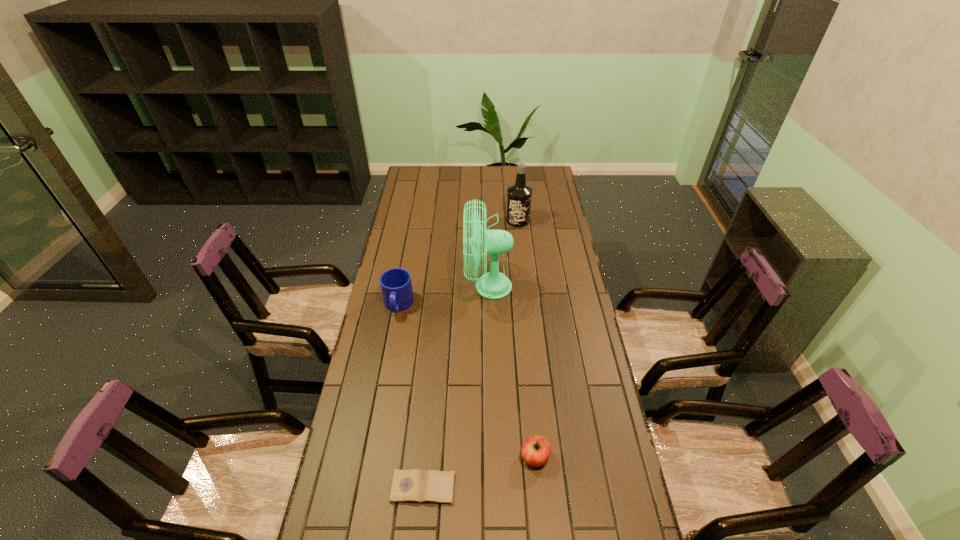
You are a GUI agent. You are given a task and a screenshot of the screen. Output one action in this format:
    pyautogui.click(x=<x>, y=<y>)
    Task: Click on the fan
    
    Given the screenshot: What is the action you would take?
    pyautogui.click(x=493, y=285)

The height and width of the screenshot is (540, 960). In order to click on the fourth shortest object in this screenshot , I will do `click(519, 195)`.

I want to click on the farthest object, so click(x=519, y=195).

This screenshot has width=960, height=540. In order to click on mug in this screenshot , I will do `click(396, 285)`.

The image size is (960, 540). Identify the location of the third tallest object. (396, 285).

Image resolution: width=960 pixels, height=540 pixels. I want to click on the fourth tallest object, so click(x=536, y=450).

You are a GUI agent. You are given a task and a screenshot of the screen. Output one action in this format:
    pyautogui.click(x=<x>, y=<y>)
    Task: Click on the diary
    
    Given the screenshot: What is the action you would take?
    pyautogui.click(x=409, y=486)

Identify the location of the shortest object. Image resolution: width=960 pixels, height=540 pixels. (409, 486).

Identify the location of free space located in front of the fan to blow air. (432, 287).

This screenshot has height=540, width=960. Identify the location of free space located 0.240m in front of the fan to blow air. (404, 287).